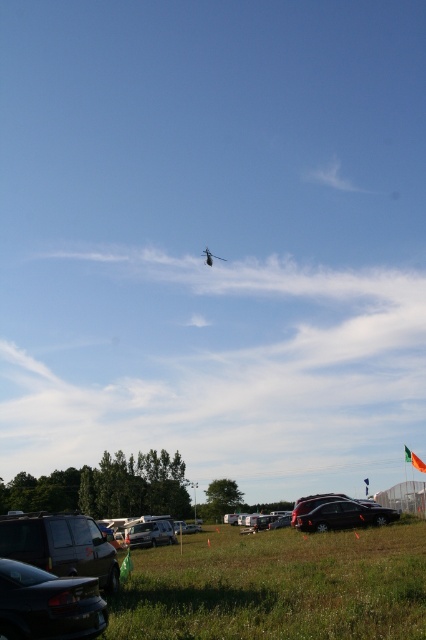
Question: Which is farther from the matte black suv at lower left?

Choices:
 (A) silver metallic van at center
 (B) green grassy field at lower center

Answer: (A)

Question: Can you confirm if green grassy field at lower center is positioned to the right of shiny black sedan at lower left?

Choices:
 (A) yes
 (B) no

Answer: (A)

Question: Can you confirm if green grassy field at lower center is smaller than silver metallic van at center?

Choices:
 (A) no
 (B) yes

Answer: (A)

Question: Which of these objects is positioned farthest from the shiny black sedan at lower left?

Choices:
 (A) green grassy field at lower center
 (B) satin black suv at lower center
 (C) silver metallic van at center
 (D) matte black suv at lower left

Answer: (C)

Question: Among these points, which one is nearest to the camera?

Choices:
 (A) (354, 516)
 (B) (203, 253)
 (C) (101, 621)

Answer: (C)

Question: Is matte black suv at lower left smaller than metallic silver helicopter at upper center?

Choices:
 (A) no
 (B) yes

Answer: (B)